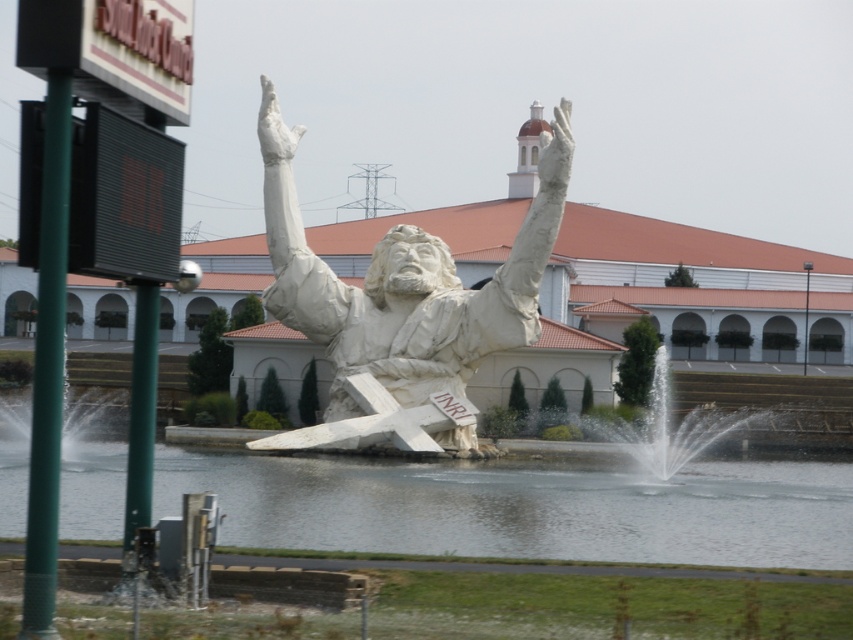
Question: Which of the following is the farthest from the observer?

Choices:
 (A) (347, 314)
 (B) (701, 420)
 (C) (282, 216)

Answer: (B)

Question: Does white marble statue at center have a larger size compared to white marble statue arm at center?

Choices:
 (A) yes
 (B) no

Answer: (A)

Question: Which object is farther from the camera taking this photo?

Choices:
 (A) white stone fountain at center
 (B) clear water at center
 (C) white marble statue at center
 (D) white marble statue arm at center

Answer: (D)

Question: Does white marble statue arm at center appear on the left side of white stone fountain at center?

Choices:
 (A) no
 (B) yes

Answer: (B)

Question: Does clear water at center have a lesser width compared to white marble statue arm at center?

Choices:
 (A) no
 (B) yes

Answer: (A)

Question: Among these objects, which one is nearest to the camera?

Choices:
 (A) white marble statue arm at center
 (B) clear water at center
 (C) white stone fountain at center

Answer: (B)